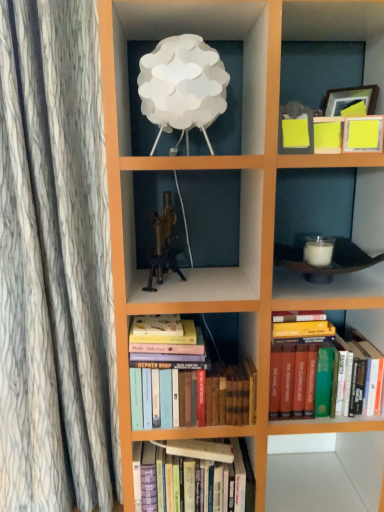
Locate an element on the screen. hardcover books at center, acting as the 1th book starting from the bottom is located at coordinates (190, 476).

Find the location of a particular element. The height and width of the screenshot is (512, 384). white paper lampshade at upper center is located at coordinates (182, 87).

At what (x,y) coordinates should I click in order to perform the action: click on hardcover books at center, acting as the 3th book starting from the top. Please return your answer as a coordinate pair (x, y). Looking at the image, I should click on (190, 476).

Can you confirm if brass metallic tripod at center is taller than hardcover books at lower right, the 3th book ordered from the bottom?

Incorrect, the height of brass metallic tripod at center is not larger of that of hardcover books at lower right, the 3th book ordered from the bottom.

Consider the image. Between brass metallic tripod at center and hardcover books at lower right, the 3th book ordered from the bottom, which one appears on the left side from the viewer's perspective?

From the viewer's perspective, brass metallic tripod at center appears more on the left side.

Which of these two, brass metallic tripod at center or hardcover books at lower right, the 3th book ordered from the bottom, is bigger?

hardcover books at lower right, the 3th book ordered from the bottom.

Which is correct: brass metallic tripod at center is inside hardcover books at lower right, the 1th book in the top-to-bottom sequence, or outside of it?

brass metallic tripod at center is not enclosed by hardcover books at lower right, the 1th book in the top-to-bottom sequence.

Based on the photo, from the image's perspective, between white paper lampshade at upper center and hardcover books at center, the second book when ordered from top to bottom, which one is located above?

white paper lampshade at upper center is shown above in the image.

Considering the positions of objects white paper lampshade at upper center and hardcover books at center, the second book in the bottom-to-top sequence, in the image provided, who is more to the left, white paper lampshade at upper center or hardcover books at center, the second book in the bottom-to-top sequence,?

white paper lampshade at upper center is more to the left.

Between white paper lampshade at upper center and hardcover books at center, the second book in the bottom-to-top sequence, which one has smaller width?

hardcover books at center, the second book in the bottom-to-top sequence.

Is hardcover books at center, acting as the 1th book starting from the bottom, to the left of white paper lampshade at upper center from the viewer's perspective?

Incorrect, hardcover books at center, acting as the 1th book starting from the bottom, is not on the left side of white paper lampshade at upper center.

From a real-world perspective, is hardcover books at center, acting as the 1th book starting from the bottom, physically above white paper lampshade at upper center?

Actually, hardcover books at center, acting as the 1th book starting from the bottom, is physically below white paper lampshade at upper center in the real world.

Does hardcover books at center, acting as the 1th book starting from the bottom, contain white paper lampshade at upper center?

No, white paper lampshade at upper center is not inside hardcover books at center, acting as the 1th book starting from the bottom.

Is there a large distance between hardcover books at center, acting as the 1th book starting from the bottom, and white paper lampshade at upper center?

hardcover books at center, acting as the 1th book starting from the bottom, is positioned a significant distance from white paper lampshade at upper center.

Can you confirm if hardcover books at lower right, the 1th book in the top-to-bottom sequence, is bigger than hardcover books at center, acting as the 3th book starting from the top?

Indeed, hardcover books at lower right, the 1th book in the top-to-bottom sequence, has a larger size compared to hardcover books at center, acting as the 3th book starting from the top.

Is hardcover books at center, acting as the 3th book starting from the top, at the back of hardcover books at lower right, the 3th book ordered from the bottom?

No.

From the image's perspective, who appears lower, hardcover books at lower right, the 1th book in the top-to-bottom sequence, or hardcover books at center, acting as the 3th book starting from the top?

From the image's view, hardcover books at center, acting as the 3th book starting from the top, is below.

Based on the photo, considering their positions, is hardcover books at lower right, the 3th book ordered from the bottom, located in front of or behind hardcover books at center, acting as the 3th book starting from the top?

Clearly, hardcover books at lower right, the 3th book ordered from the bottom, is in front of hardcover books at center, acting as the 3th book starting from the top.

Is brass metallic tripod at center facing away from hardcover books at center, acting as the 3th book starting from the top?

No, brass metallic tripod at center's orientation is not away from hardcover books at center, acting as the 3th book starting from the top.

Consider the image. Does brass metallic tripod at center have a greater width compared to hardcover books at center, acting as the 3th book starting from the top?

No.

From the image's perspective, relative to hardcover books at center, acting as the 3th book starting from the top, is brass metallic tripod at center above or below?

Clearly, from the image's perspective, brass metallic tripod at center is above hardcover books at center, acting as the 3th book starting from the top.

Is brass metallic tripod at center positioned behind hardcover books at center, acting as the 1th book starting from the bottom?

No, it is in front of hardcover books at center, acting as the 1th book starting from the bottom.

Based on the photo, in the image, is hardcover books at lower right, the 1th book in the top-to-bottom sequence, positioned in front of or behind hardcover books at center, the second book when ordered from top to bottom?

hardcover books at lower right, the 1th book in the top-to-bottom sequence, is positioned farther from the viewer than hardcover books at center, the second book when ordered from top to bottom.

Is hardcover books at lower right, the 1th book in the top-to-bottom sequence, not near hardcover books at center, the second book in the bottom-to-top sequence?

No.

Locate an element on the screen. book in front of the hardcover books at lower right, the 3th book ordered from the bottom is located at coordinates (190, 391).

From the image's perspective, which one is positioned lower, hardcover books at lower right, the 3th book ordered from the bottom, or hardcover books at center, the second book in the bottom-to-top sequence?

hardcover books at center, the second book in the bottom-to-top sequence.

Which object is positioned more to the left, hardcover books at center, the second book in the bottom-to-top sequence, or white paper lampshade at upper center?

white paper lampshade at upper center.

Is hardcover books at center, the second book when ordered from top to bottom, facing away from white paper lampshade at upper center?

That's not correct — hardcover books at center, the second book when ordered from top to bottom, is not looking away from white paper lampshade at upper center.

Is hardcover books at center, the second book when ordered from top to bottom, located outside white paper lampshade at upper center?

Yes, hardcover books at center, the second book when ordered from top to bottom, is not within white paper lampshade at upper center.

Is hardcover books at center, the second book when ordered from top to bottom, smaller than white paper lampshade at upper center?

No, hardcover books at center, the second book when ordered from top to bottom, is not smaller than white paper lampshade at upper center.

Find the location of `toy that is above the hardcover books at lower right, the 3th book ordered from the bottom (from the image's perspective)`. toy that is above the hardcover books at lower right, the 3th book ordered from the bottom (from the image's perspective) is located at coordinates (163, 244).

Locate an element on the screen. This screenshot has height=512, width=384. the 1st book behind the white paper lampshade at upper center, starting your count from the anchor is located at coordinates (190, 391).

From the image, which object appears to be nearer to white paper lampshade at upper center, hardcover books at lower right, the 1th book in the top-to-bottom sequence, or brass metallic tripod at center?

Among the two, brass metallic tripod at center is located nearer to white paper lampshade at upper center.

Estimate the real-world distances between objects in this image. Which object is further from white paper lampshade at upper center, brass metallic tripod at center or hardcover books at lower right, the 1th book in the top-to-bottom sequence?

Based on the image, hardcover books at lower right, the 1th book in the top-to-bottom sequence, appears to be further to white paper lampshade at upper center.

Based on their spatial positions, is hardcover books at center, acting as the 1th book starting from the bottom, or hardcover books at lower right, the 3th book ordered from the bottom, further from white paper lampshade at upper center?

hardcover books at center, acting as the 1th book starting from the bottom, lies further to white paper lampshade at upper center than the other object.

From the picture: Considering their positions, is brass metallic tripod at center positioned closer to hardcover books at center, acting as the 3th book starting from the top, than white paper lampshade at upper center?

brass metallic tripod at center.

Looking at the image, which one is located further to brass metallic tripod at center, hardcover books at center, acting as the 1th book starting from the bottom, or white paper lampshade at upper center?

hardcover books at center, acting as the 1th book starting from the bottom, lies further to brass metallic tripod at center than the other object.

Considering their positions, is brass metallic tripod at center positioned closer to white paper lampshade at upper center than hardcover books at center, acting as the 3th book starting from the top?

brass metallic tripod at center is closer to white paper lampshade at upper center.

Based on their spatial positions, is hardcover books at center, acting as the 3th book starting from the top, or white paper lampshade at upper center further from hardcover books at lower right, the 1th book in the top-to-bottom sequence?

white paper lampshade at upper center is further to hardcover books at lower right, the 1th book in the top-to-bottom sequence.

From the image, which object appears to be nearer to hardcover books at center, the second book when ordered from top to bottom, white paper lampshade at upper center or hardcover books at lower right, the 3th book ordered from the bottom?

hardcover books at lower right, the 3th book ordered from the bottom, is positioned closer to the anchor hardcover books at center, the second book when ordered from top to bottom.

The image size is (384, 512). Find the location of `toy that lies between white paper lampshade at upper center and hardcover books at center, the second book in the bottom-to-top sequence, from top to bottom`. toy that lies between white paper lampshade at upper center and hardcover books at center, the second book in the bottom-to-top sequence, from top to bottom is located at coordinates (163, 244).

The height and width of the screenshot is (512, 384). In order to click on book between hardcover books at center, acting as the 3th book starting from the top, and hardcover books at lower right, the 1th book in the top-to-bottom sequence in this screenshot , I will do `click(190, 391)`.

Image resolution: width=384 pixels, height=512 pixels. Identify the location of book between white paper lampshade at upper center and hardcover books at center, the second book in the bottom-to-top sequence, in the up-down direction. (301, 365).

The image size is (384, 512). Identify the location of toy between white paper lampshade at upper center and hardcover books at center, acting as the 1th book starting from the bottom, in the vertical direction. [x=163, y=244].